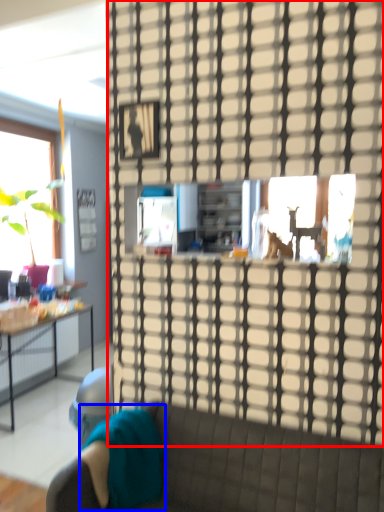
Question: Which object is closer to the camera taking this photo, glass door (highlighted by a red box) or pillow (highlighted by a blue box)?

Choices:
 (A) glass door
 (B) pillow

Answer: (A)